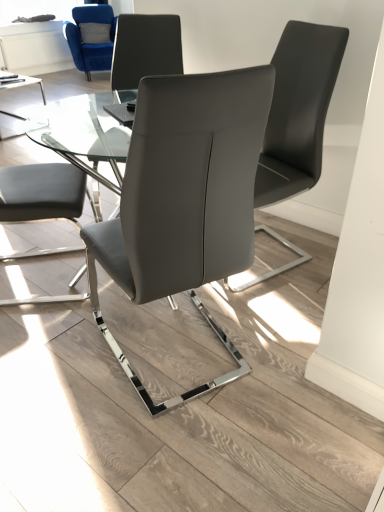
The image size is (384, 512). I want to click on vacant space to the right of matte gray chair at center, the third chair from the left, so click(288, 339).